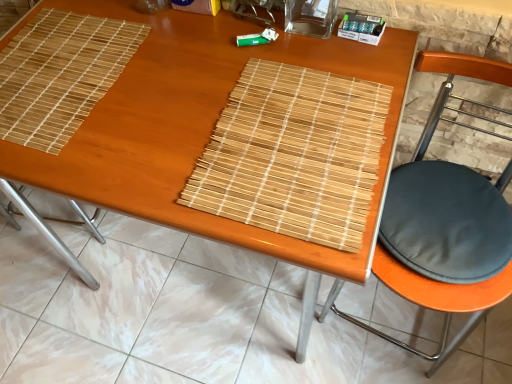
Question: Is natural bamboo mat at center, which ranks as the first mat in right-to-left order, shorter than black fabric cushion at right?

Choices:
 (A) yes
 (B) no

Answer: (A)

Question: Is natural bamboo mat at center, positioned as the second mat in left-to-right order, in front of black fabric cushion at right?

Choices:
 (A) yes
 (B) no

Answer: (B)

Question: Does natural bamboo mat at center, which ranks as the first mat in right-to-left order, have a lesser width compared to black fabric cushion at right?

Choices:
 (A) yes
 (B) no

Answer: (A)

Question: Does natural bamboo mat at center, positioned as the second mat in left-to-right order, contain black fabric cushion at right?

Choices:
 (A) no
 (B) yes

Answer: (A)

Question: Does natural bamboo mat at center, positioned as the second mat in left-to-right order, have a greater width compared to black fabric cushion at right?

Choices:
 (A) yes
 (B) no

Answer: (B)

Question: From a real-world perspective, is natural bamboo mat at center, which ranks as the first mat in right-to-left order, positioned under black fabric cushion at right based on gravity?

Choices:
 (A) yes
 (B) no

Answer: (B)

Question: Is black fabric cushion at right oriented away from natural bamboo mat at center, which ranks as the first mat in right-to-left order?

Choices:
 (A) no
 (B) yes

Answer: (A)

Question: Considering the relative sizes of black fabric cushion at right and natural bamboo mat at center, positioned as the second mat in left-to-right order, in the image provided, is black fabric cushion at right wider than natural bamboo mat at center, positioned as the second mat in left-to-right order,?

Choices:
 (A) no
 (B) yes

Answer: (B)

Question: Is black fabric cushion at right not within natural bamboo mat at center, which ranks as the first mat in right-to-left order?

Choices:
 (A) yes
 (B) no

Answer: (A)

Question: Does black fabric cushion at right have a lesser height compared to natural bamboo mat at center, positioned as the second mat in left-to-right order?

Choices:
 (A) no
 (B) yes

Answer: (A)

Question: Is the depth of black fabric cushion at right greater than that of natural bamboo mat at center, which ranks as the first mat in right-to-left order?

Choices:
 (A) no
 (B) yes

Answer: (A)

Question: From the image's perspective, would you say black fabric cushion at right is positioned over natural bamboo mat at center, positioned as the second mat in left-to-right order?

Choices:
 (A) yes
 (B) no

Answer: (B)

Question: Can you confirm if black fabric cushion at right is positioned to the left of bamboo placemat at center?

Choices:
 (A) no
 (B) yes

Answer: (A)